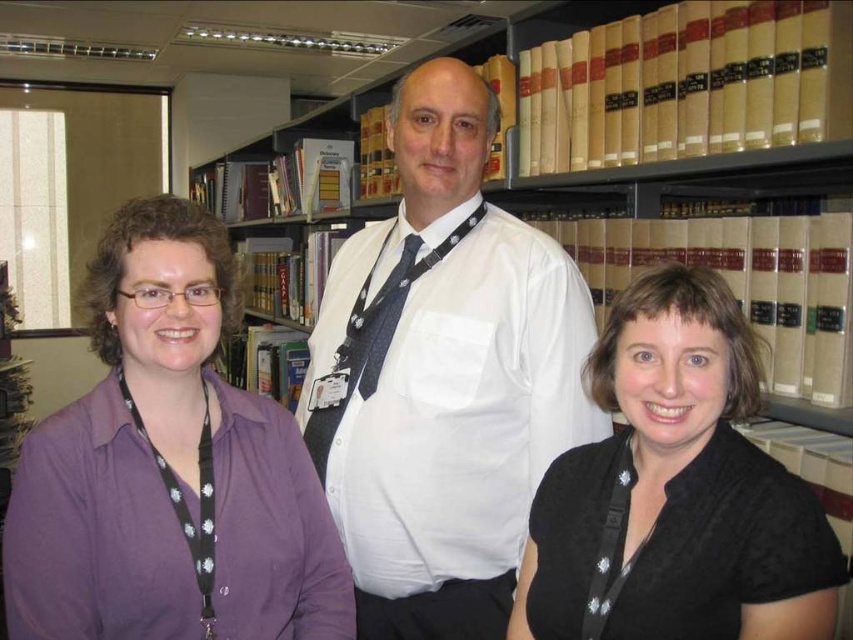
Is point (741, 454) farther from camera compared to point (375, 378)?

No, it is in front of (375, 378).

Describe the element at coordinates (677, 490) in the screenshot. The image size is (853, 640). I see `black textured blouse at lower right` at that location.

The height and width of the screenshot is (640, 853). What are the coordinates of `black textured blouse at lower right` in the screenshot? It's located at (677, 490).

Does purple shirt at left have a greater height compared to dark blue textured tie at center?

Correct, purple shirt at left is much taller as dark blue textured tie at center.

Which is more to the left, purple shirt at left or dark blue textured tie at center?

Positioned to the left is purple shirt at left.

I want to click on purple shirt at left, so click(169, 468).

Who is lower down, white shirt at center or dark blue textured tie at center?

Positioned lower is dark blue textured tie at center.

Does white shirt at center have a smaller size compared to dark blue textured tie at center?

Incorrect, white shirt at center is not smaller in size than dark blue textured tie at center.

You are a GUI agent. You are given a task and a screenshot of the screen. Output one action in this format:
    pyautogui.click(x=<x>, y=<y>)
    Task: Click on the white shirt at center
    
    Given the screenshot: What is the action you would take?
    pyautogui.click(x=444, y=376)